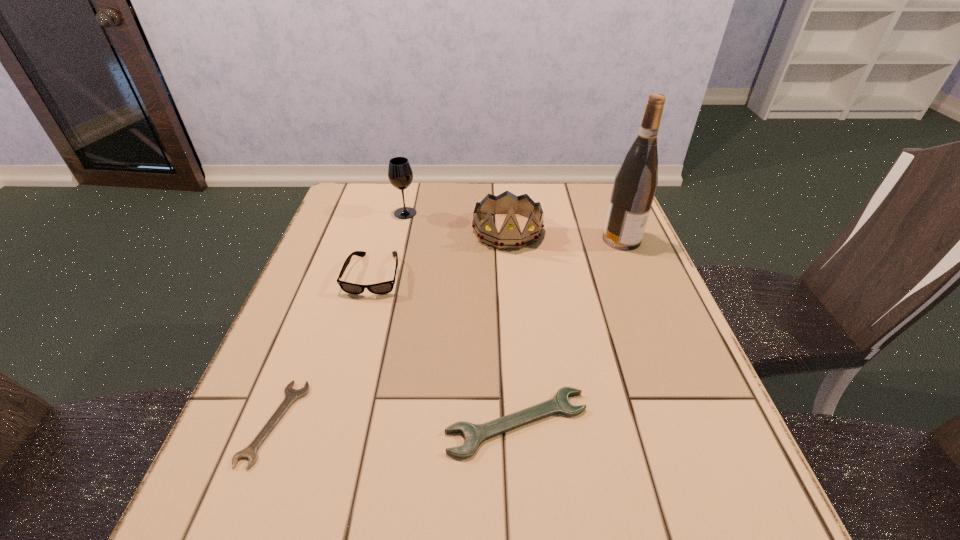
This screenshot has height=540, width=960. Identify the location of the tallest object. (635, 183).

Locate an element on the screen. wine bottle is located at coordinates (635, 183).

The image size is (960, 540). Find the location of `wineglass`. wineglass is located at coordinates (400, 174).

This screenshot has height=540, width=960. What are the coordinates of `the third tallest object` in the screenshot? It's located at (510, 236).

This screenshot has width=960, height=540. I want to click on the fourth tallest object, so point(386,287).

Where is `the fourth farthest object`? the fourth farthest object is located at coordinates (386, 287).

Locate an element on the screen. the right wrench is located at coordinates (474, 434).

Locate an element on the screen. Image resolution: width=960 pixels, height=540 pixels. the taller wrench is located at coordinates (474, 434).

Locate an element on the screen. The image size is (960, 540). the shortest object is located at coordinates (291, 395).

Identify the location of the left wrench. (291, 395).